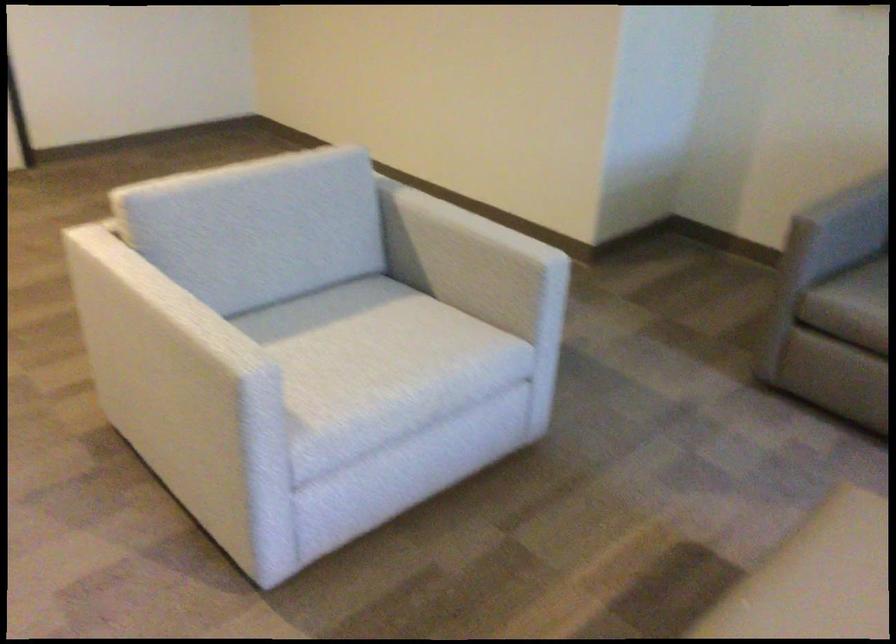
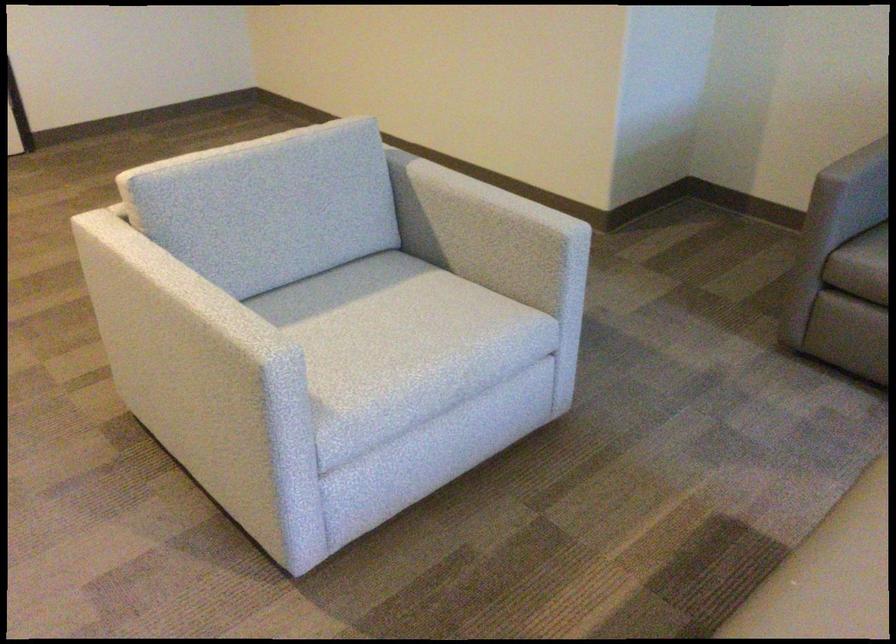
Locate, in the second image, the point that corresponds to point 487,218 in the first image.

(496, 180)